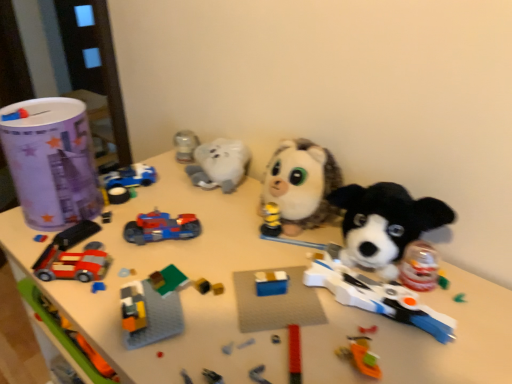
Find the location of `vacant space to the left of fluffy white plush at center, acting as the 1th toy starting from the right`. vacant space to the left of fluffy white plush at center, acting as the 1th toy starting from the right is located at coordinates (209, 222).